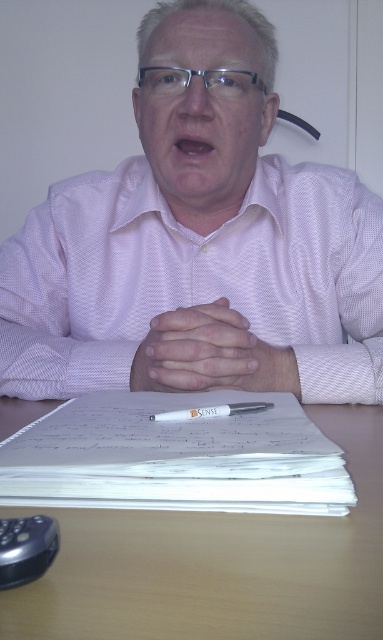
You are organizing a small desk space and need to place both the pink textured shirt at center and the black plastic mouse at lower left. If the desk has limited width, which object should you prioritize keeping on the desk?

The pink textured shirt at center is wider than the black plastic mouse at lower left, so you should prioritize keeping the pink textured shirt at center on the desk since it takes up more space.

You are a student who needs to write a note. You see the light brown wooden table at center and the white plastic pen at center. Which object is taller?

The light brown wooden table at center is taller than the white plastic pen at center.